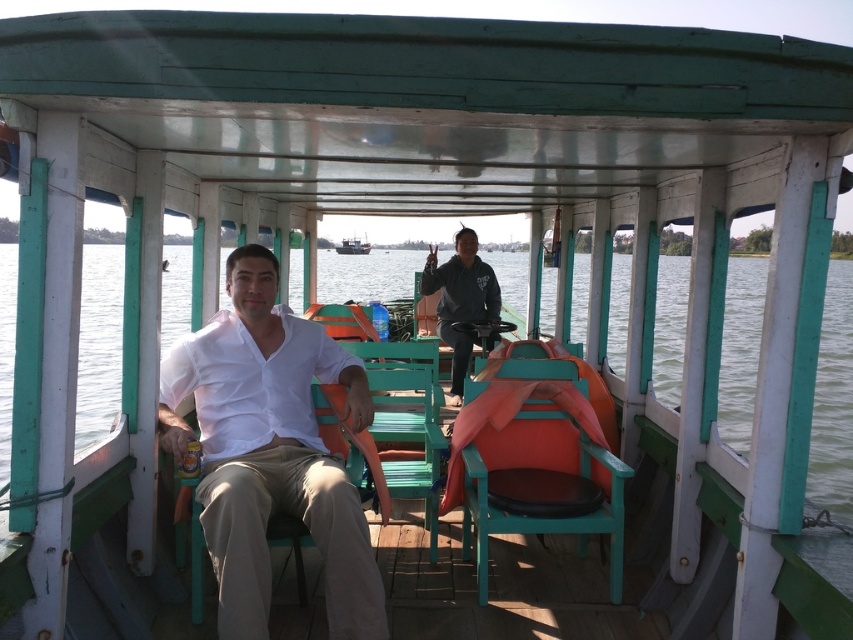
You are standing on the dock and looking at the wooden boat at center with a dark gray hoodie at center inside it. Which object appears taller from your perspective?

The dark gray hoodie at center appears taller than the wooden boat at center because it is much taller as wooden boat at center according to the description.

You are a photographer planning to take a portrait of the person wearing the white matte shirt at center while they are seated on the teal wood chair at center. Based on their sizes, do you think the shirt will be visible above the chair in the photo?

The white matte shirt at center is taller than the teal wood chair at center, so yes, the shirt will be visible above the chair in the photo.